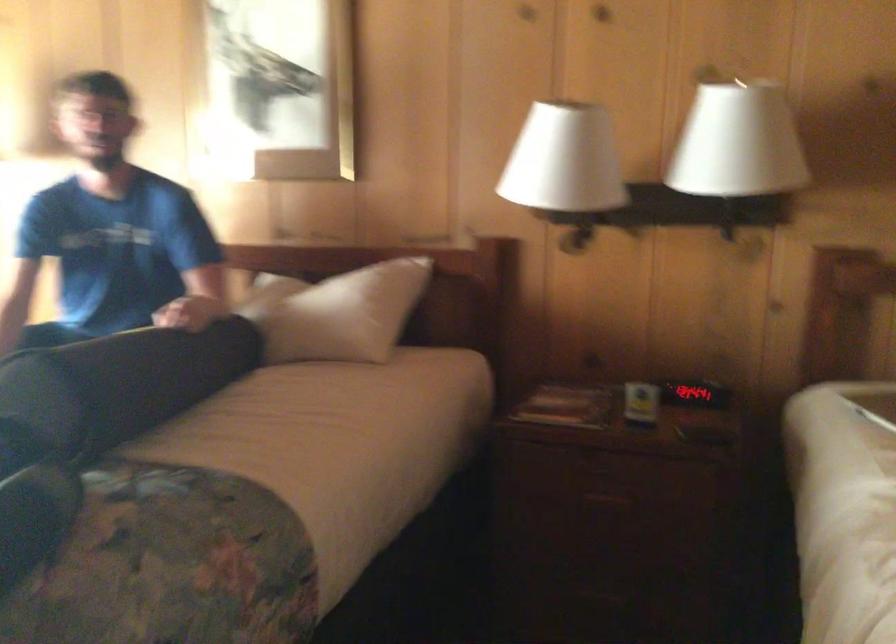
This screenshot has height=644, width=896. What are the coordinates of `white pillow` in the screenshot? It's located at (340, 313).